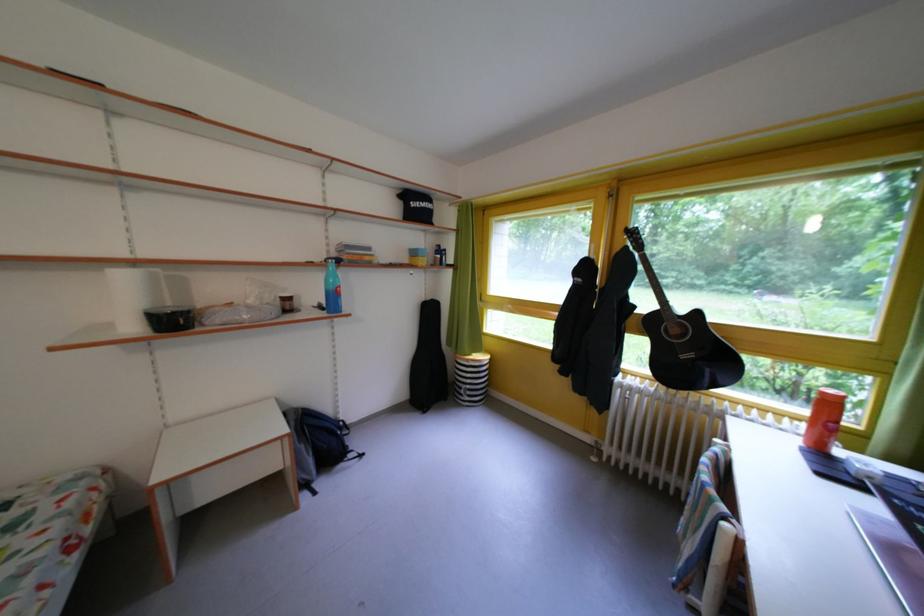
Find the location of a particular element. striped laundry hamper is located at coordinates (470, 378).